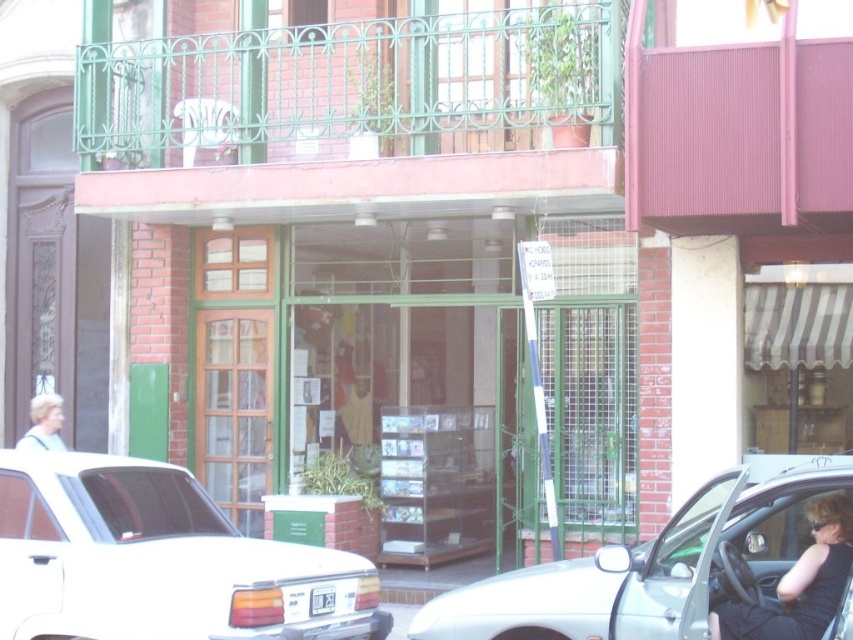
You are a pedestrian standing on the sidewalk and see the silver metallic car at center and the black fabric woman at lower right. Which object is closer to you?

The silver metallic car at center is closer to you because it is in front of the black fabric woman at lower right.

You are standing on the street looking at the storefront with the green metal balcony above it. There are two points marked on the image. Which point is closer to you, point at coordinates (103, 520) or point at coordinates (821, 612)?

Point at coordinates (103, 520) is closer to you because it is further to the viewer than point at coordinates (821, 612).

You are a delivery person trying to park your van next to the white glossy sedan at center and the black fabric woman at lower right. Since your van is 6 meters long, can you fit it between them without moving either object?

The white glossy sedan at center is bigger than the black fabric woman at lower right, but the exact distance between them isn